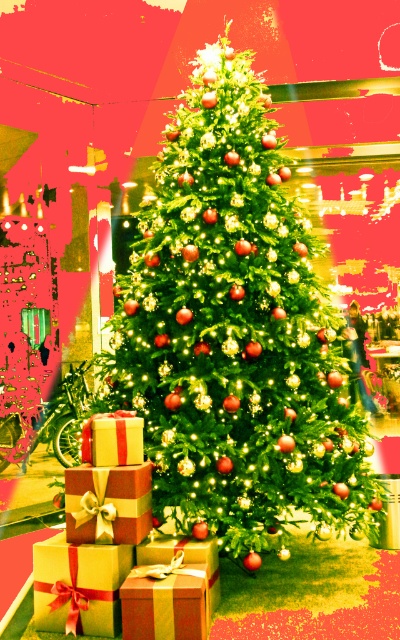
You are a store employee arranging gifts under the Christmas tree. You have two gifts to place side by side on the shelf below the tree. The gifts are the matte gold gift at center and the gold shiny gift at center. Given their sizes, which gift will require more shelf space horizontally?

The matte gold gift at center requires more horizontal shelf space because it is wider than the gold shiny gift at center.